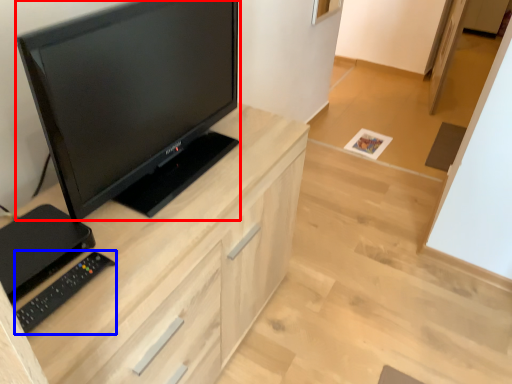
Question: Which object is closer to the camera taking this photo, television (highlighted by a red box) or equipment (highlighted by a blue box)?

Choices:
 (A) television
 (B) equipment

Answer: (A)